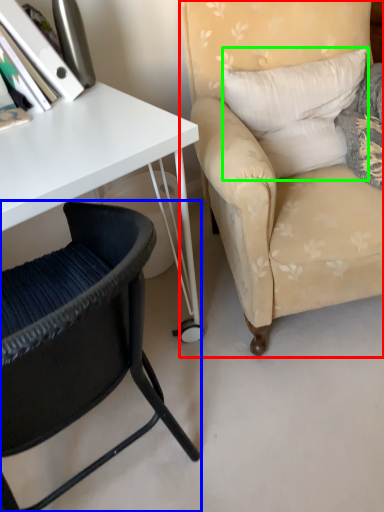
Question: Based on their relative distances, which object is farther from chair (highlighted by a red box)? Choose from chair (highlighted by a blue box) and pillow (highlighted by a green box).

Choices:
 (A) chair
 (B) pillow

Answer: (A)